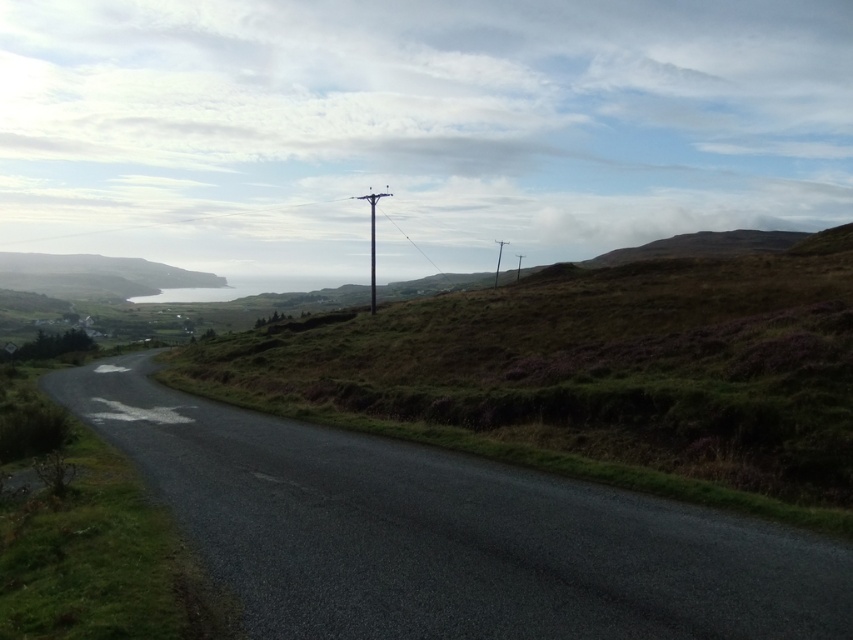
Does green grassy at left appear over smooth gray pole at center?

No.

Is green grassy at left below smooth gray pole at center?

Correct, green grassy at left is located below smooth gray pole at center.

Is point (100, 488) less distant than point (374, 310)?

Yes, it is in front of point (374, 310).

Image resolution: width=853 pixels, height=640 pixels. Identify the location of green grassy at left. (99, 557).

Is smooth gray pole at center positioned behind brown wooden telegraph pole at center?

No, it is not.

Does smooth gray pole at center have a lesser height compared to brown wooden telegraph pole at center?

In fact, smooth gray pole at center may be taller than brown wooden telegraph pole at center.

Who is more forward, (372,220) or (492,282)?

Point (492,282) is in front.

Locate an element on the screen. This screenshot has height=640, width=853. smooth gray pole at center is located at coordinates (372, 240).

Does metallic wire at upper center have a greater width compared to brown wooden telegraph pole at center?

Yes, metallic wire at upper center is wider than brown wooden telegraph pole at center.

Can you confirm if metallic wire at upper center is taller than brown wooden telegraph pole at center?

No, metallic wire at upper center is not taller than brown wooden telegraph pole at center.

Which is in front, point (71, 234) or point (502, 244)?

Point (502, 244) is in front.

You are a GUI agent. You are given a task and a screenshot of the screen. Output one action in this format:
    pyautogui.click(x=<x>, y=<y>)
    Task: Click on the metallic wire at upper center
    This screenshot has width=853, height=640.
    Given the screenshot: What is the action you would take?
    pyautogui.click(x=173, y=221)